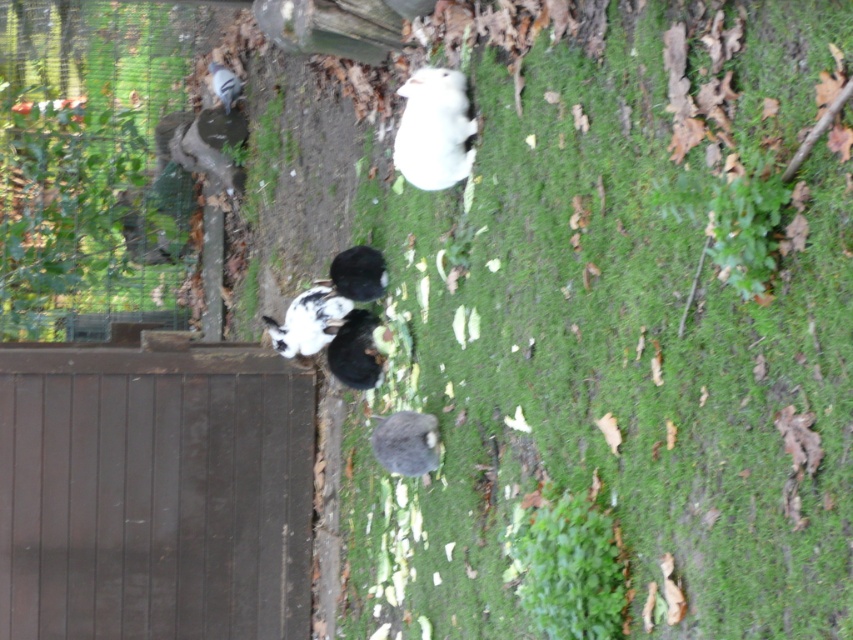
You are standing at the entrance of the enclosure and see the brown wooden gate at lower left and the white fluffy rabbit at upper center. Which object is positioned higher from the ground?

The white fluffy rabbit at upper center is positioned higher from the ground than the brown wooden gate at lower left.

You are a delivery person holding a package that needs to be placed exactly 10 feet away from the brown wooden gate at lower left. Can you place the package near the white fluffy rabbit at upper center?

The distance between the brown wooden gate at lower left and the white fluffy rabbit at upper center is 8.31 feet, which is less than 10 feet. Therefore, placing the package near the white fluffy rabbit at upper center would not meet the requirement of being 10 feet away from the brown wooden gate at lower left.